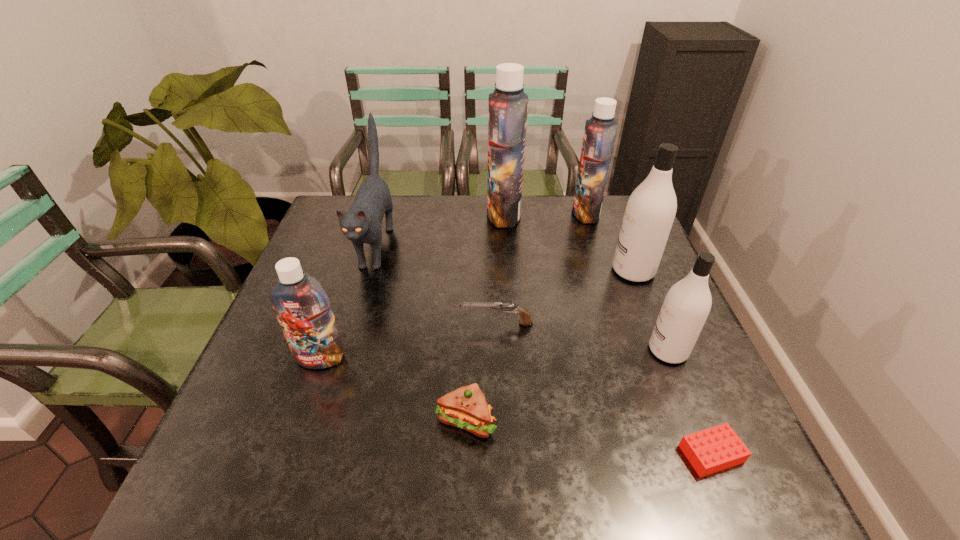
This screenshot has height=540, width=960. I want to click on the second blue shampoo from left to right, so click(508, 105).

This screenshot has height=540, width=960. I want to click on the biggest blue shampoo, so click(x=508, y=105).

Locate an element on the screen. The height and width of the screenshot is (540, 960). the rightmost blue shampoo is located at coordinates (600, 131).

Where is `the bigger white shampoo`? This screenshot has height=540, width=960. the bigger white shampoo is located at coordinates (650, 211).

Find the location of `the farther white shampoo`. the farther white shampoo is located at coordinates (650, 211).

Locate an element on the screen. The image size is (960, 540). cat is located at coordinates (361, 224).

Locate an element on the screen. The height and width of the screenshot is (540, 960). the smaller white shampoo is located at coordinates (687, 304).

The image size is (960, 540). Identify the location of the leftmost shampoo. (302, 307).

You are a GUI agent. You are given a task and a screenshot of the screen. Output one action in this format:
    pyautogui.click(x=<x>, y=<y>)
    Task: Click on the nearest blue shampoo
    This screenshot has width=960, height=540.
    Given the screenshot: What is the action you would take?
    pyautogui.click(x=302, y=307)

The height and width of the screenshot is (540, 960). What are the coordinates of `sandwich` in the screenshot? It's located at (466, 407).